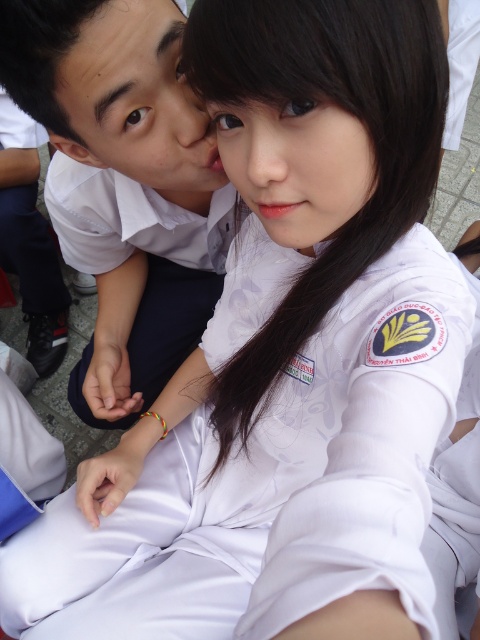
Describe the element at coordinates (124, 182) in the screenshot. Image resolution: width=480 pixels, height=640 pixels. I see `white smooth shirt at upper left` at that location.

Which is behind, point (78, 3) or point (302, 232)?

The point (302, 232) is behind.

Where is `white smooth shirt at upper left`? The image size is (480, 640). white smooth shirt at upper left is located at coordinates (124, 182).

Who is taller, white smooth shirt at upper left or matte white face at upper left?

white smooth shirt at upper left

Is point (107, 291) farther from camera compared to point (63, 140)?

Yes, point (107, 291) is behind point (63, 140).

Where is `white smooth shirt at upper left`? The height and width of the screenshot is (640, 480). white smooth shirt at upper left is located at coordinates (124, 182).

Is matte white face at upper left bigger than smooth skin face at center?

Correct, matte white face at upper left is larger in size than smooth skin face at center.

Is matte white face at upper left further to the viewer compared to smooth skin face at center?

Yes, matte white face at upper left is behind smooth skin face at center.

This screenshot has height=640, width=480. What do you see at coordinates (137, 102) in the screenshot?
I see `matte white face at upper left` at bounding box center [137, 102].

Identify the location of matte white face at upper left. The image size is (480, 640). (137, 102).